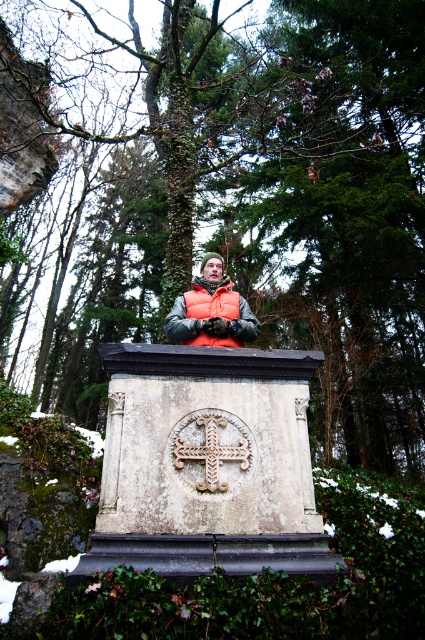
Question: Does white stone monument at center lie behind rusty metal cross at center?

Choices:
 (A) no
 (B) yes

Answer: (A)

Question: Estimate the real-world distances between objects in this image. Which object is farther from the rusty metal cross at center?

Choices:
 (A) white stone monument at center
 (B) green leafy tree at center

Answer: (B)

Question: Which point is farther to the camera?

Choices:
 (A) white stone monument at center
 (B) orange fleece vest at center
 (C) rusty metal cross at center

Answer: (B)

Question: Can you confirm if white stone monument at center is positioned below orange fleece vest at center?

Choices:
 (A) no
 (B) yes

Answer: (B)

Question: Is green leafy tree at center bigger than orange fleece vest at center?

Choices:
 (A) no
 (B) yes

Answer: (B)

Question: Which of these objects is positioned closest to the rusty metal cross at center?

Choices:
 (A) white stone monument at center
 (B) orange fleece vest at center

Answer: (A)